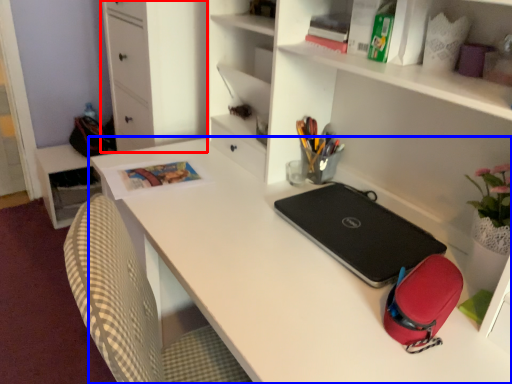
Question: Which of the following is the closest to the observer, file cabinet (highlighted by a red box) or desk (highlighted by a blue box)?

Choices:
 (A) file cabinet
 (B) desk

Answer: (B)